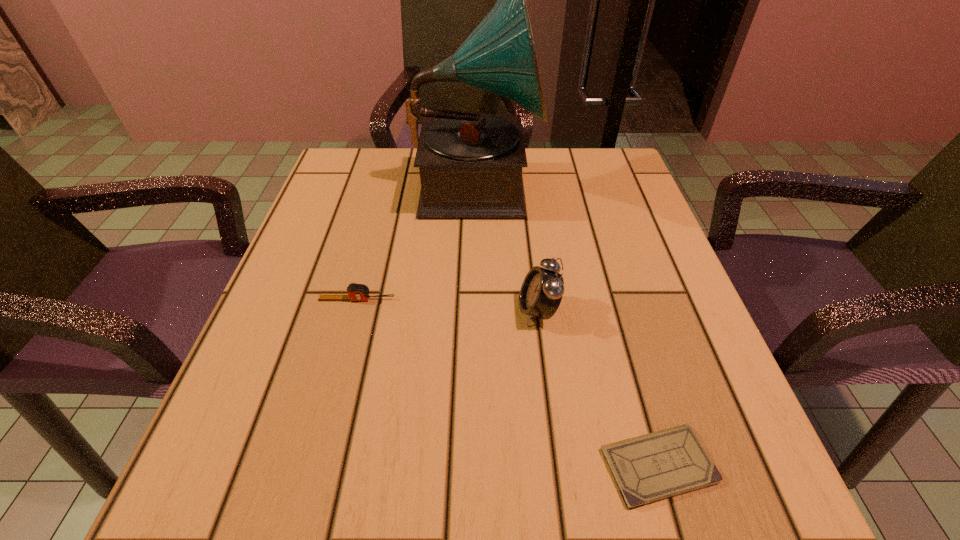
Identify the location of vacant space at the far left corner. The image size is (960, 540). (334, 156).

Where is `vacant space at the near left corner of the desktop`? Image resolution: width=960 pixels, height=540 pixels. vacant space at the near left corner of the desktop is located at coordinates (248, 491).

Locate an element on the screen. vacant region at the far right corner of the desktop is located at coordinates (604, 149).

Locate an element on the screen. The width and height of the screenshot is (960, 540). vacant region at the near right corner of the desktop is located at coordinates (772, 505).

I want to click on free space that is in between the third tallest object and the record player, so click(x=417, y=242).

The height and width of the screenshot is (540, 960). In order to click on free space between the alarm clock and the third tallest object in this screenshot , I will do `click(447, 305)`.

Identify the location of vacant area that lies between the second tallest object and the second shortest object. This screenshot has height=540, width=960. (447, 305).

Find the location of a particular element. empty space between the tape measure and the alarm clock is located at coordinates (447, 305).

The height and width of the screenshot is (540, 960). Find the location of `free spot between the shortest object and the tape measure`. free spot between the shortest object and the tape measure is located at coordinates (508, 382).

The width and height of the screenshot is (960, 540). Find the location of `vacant area that lies between the tallest object and the shortest object`. vacant area that lies between the tallest object and the shortest object is located at coordinates (567, 325).